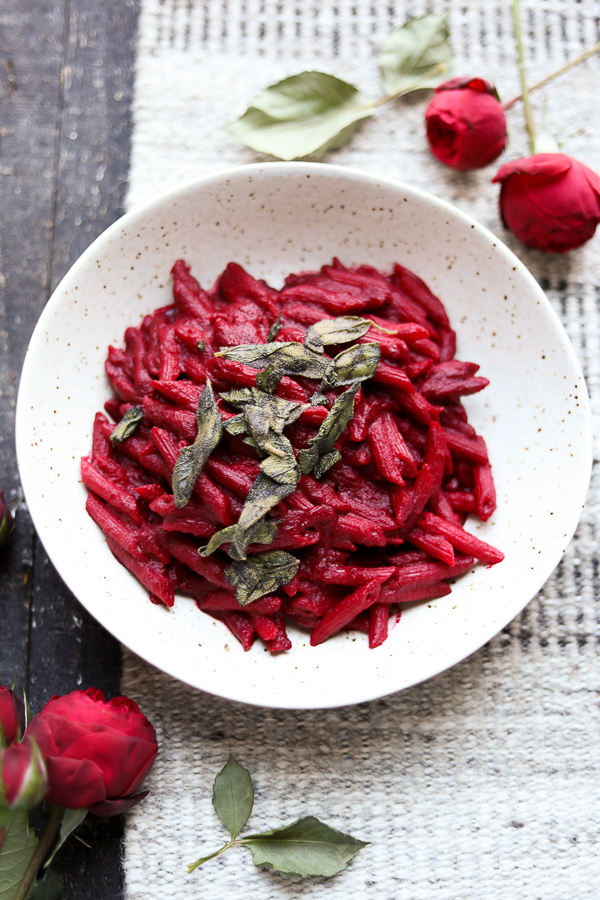
Where is `wooden table surface`? The image size is (600, 900). wooden table surface is located at coordinates (49, 648), (87, 99).